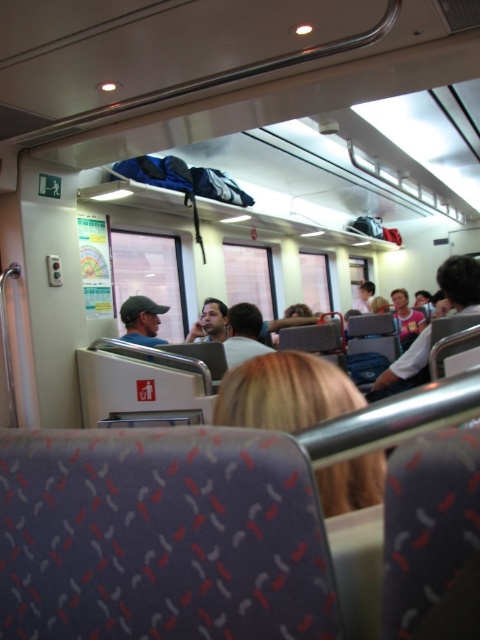
Is point (385, 378) farther from viewer compared to point (402, 326)?

No.

Describe the element at coordinates (460, 284) in the screenshot. I see `white shirt at right` at that location.

Who is more forward, (392, 381) or (424, 323)?

Point (392, 381)

This screenshot has width=480, height=640. Find the location of `white shirt at right`. white shirt at right is located at coordinates (460, 284).

Is blonde hair at center positioned in front of matte pink shirt at center?

Yes.

Can you confirm if blonde hair at center is smaller than matte pink shirt at center?

Yes, blonde hair at center is smaller than matte pink shirt at center.

Does point (224, 417) come closer to viewer compared to point (408, 324)?

Yes, it is.

I want to click on blonde hair at center, so click(284, 392).

Is the position of white shirt at right less distant than that of smooth skin face at center?

Yes, white shirt at right is closer to the viewer.

Between white shirt at right and smooth skin face at center, which one is positioned higher?

smooth skin face at center is above.

Image resolution: width=480 pixels, height=640 pixels. I want to click on white shirt at right, so click(460, 284).

In order to click on white shirt at right in this screenshot , I will do `click(460, 284)`.